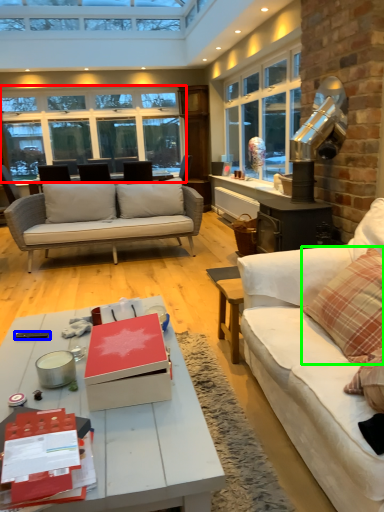
Question: Considering the real-world distances, which object is farthest from window (highlighted by a red box)? remote control (highlighted by a blue box) or pillow (highlighted by a green box)?

Choices:
 (A) remote control
 (B) pillow

Answer: (B)